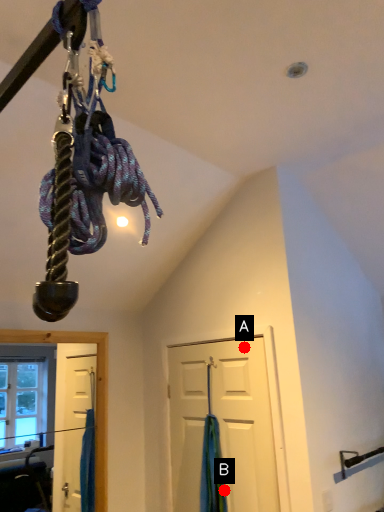
Question: Two points are circled on the image, labeled by A and B beside each circle. Which point is closer to the camera?

Choices:
 (A) A is closer
 (B) B is closer

Answer: (B)